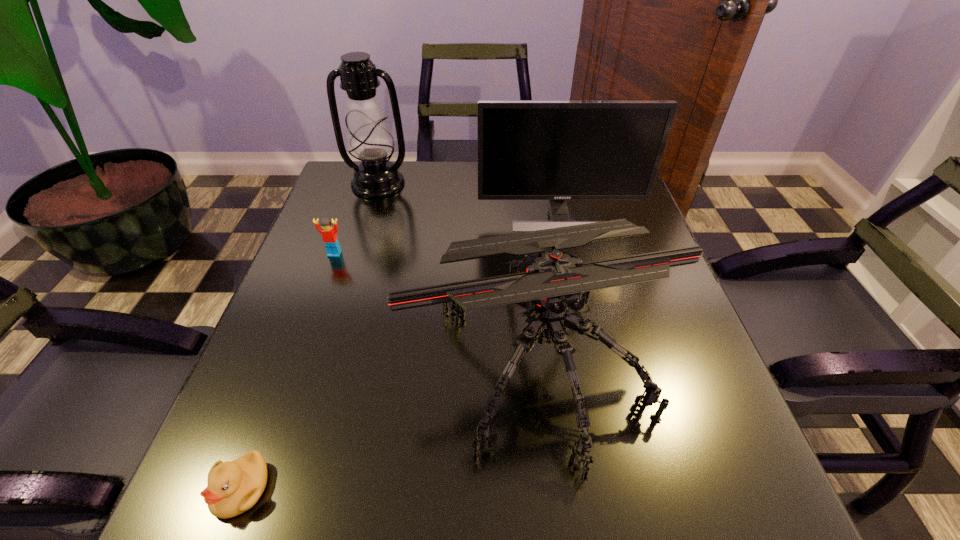
The height and width of the screenshot is (540, 960). I want to click on free space between the drone and the oil lamp, so click(459, 273).

The height and width of the screenshot is (540, 960). What are the coordinates of `vacant region between the oil lamp and the third nearest object` in the screenshot? It's located at (356, 219).

You are a GUI agent. You are given a task and a screenshot of the screen. Output one action in this format:
    pyautogui.click(x=<x>, y=<y>)
    Task: Click on the free spot between the Lego and the farthest object
    This screenshot has width=960, height=540.
    Given the screenshot: What is the action you would take?
    click(x=356, y=219)

This screenshot has height=540, width=960. What are the coordinates of `empty space between the oil lamp and the second shortest object` in the screenshot? It's located at (356, 219).

Locate an element on the screen. free space between the second shortest object and the oil lamp is located at coordinates (356, 219).

This screenshot has height=540, width=960. In order to click on object that is the closest to the monitor in this screenshot , I will do `click(548, 282)`.

You are a GUI agent. You are given a task and a screenshot of the screen. Output one action in this format:
    pyautogui.click(x=<x>, y=<y>)
    Task: Click on the object that is the second closest to the shortest object
    This screenshot has height=540, width=960.
    Given the screenshot: What is the action you would take?
    click(329, 234)

What are the coordinates of `vacant space that satisfies the following two spatial constraints: 1. on the face of the drone; 2. on the left side of the Lego` in the screenshot? It's located at (296, 361).

What are the coordinates of `vacant space that satisfies the following two spatial constraints: 1. on the front side of the drone; 2. on the left side of the farthest object` in the screenshot? It's located at (324, 361).